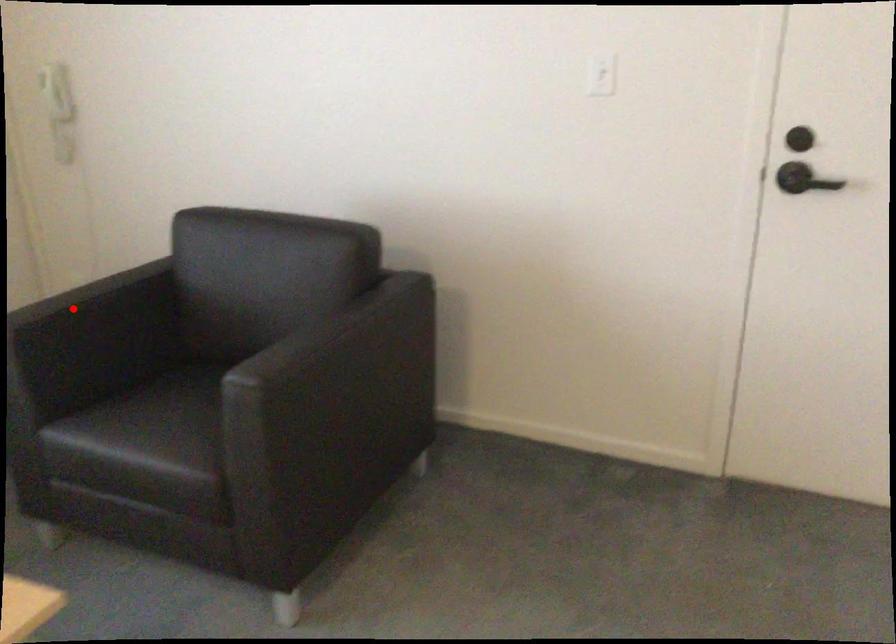
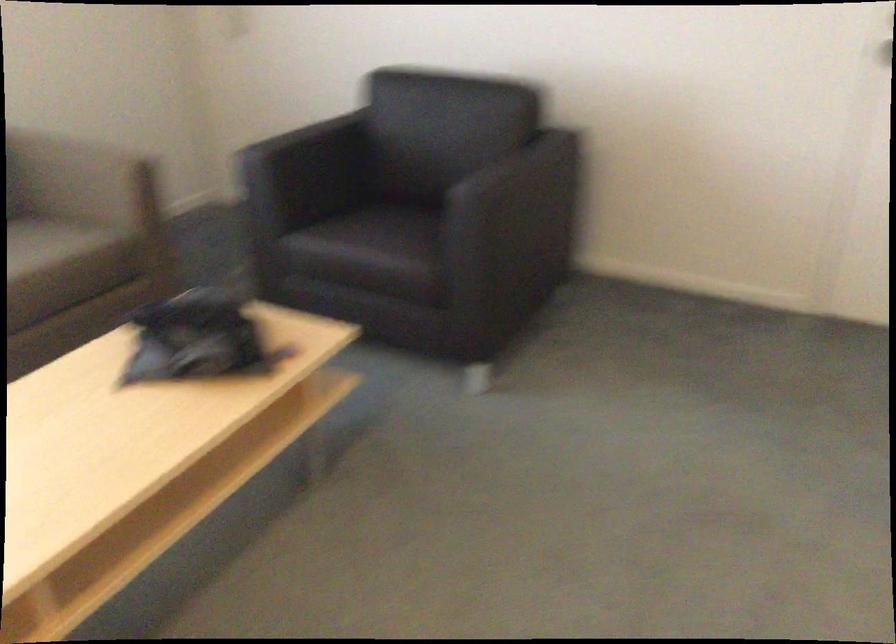
Question: I am providing you with two images of the same scene from different viewpoints. In image1, a red point is highlighted. Considering the same 3D point in image2, which of the following is correct?

Choices:
 (A) It is closer
 (B) It is farther

Answer: (B)